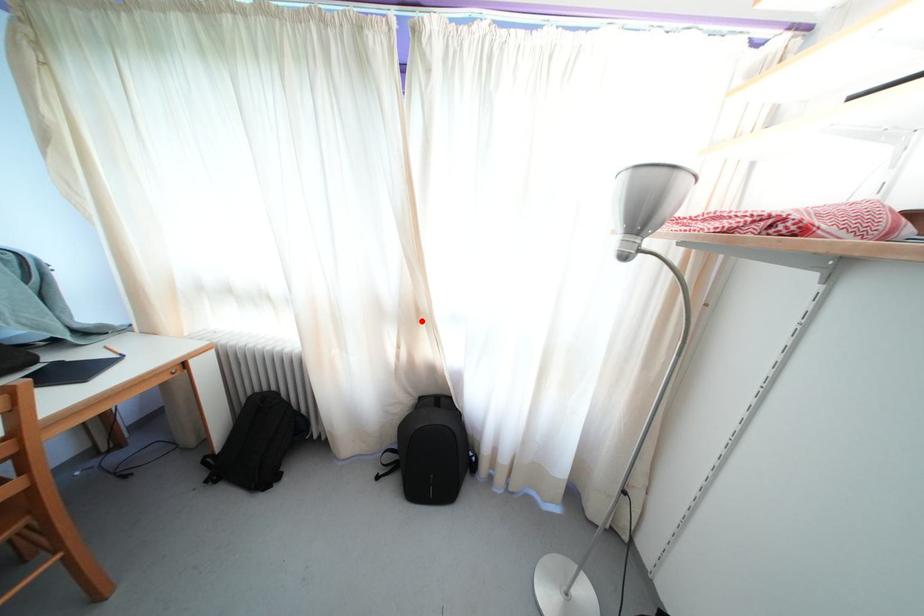
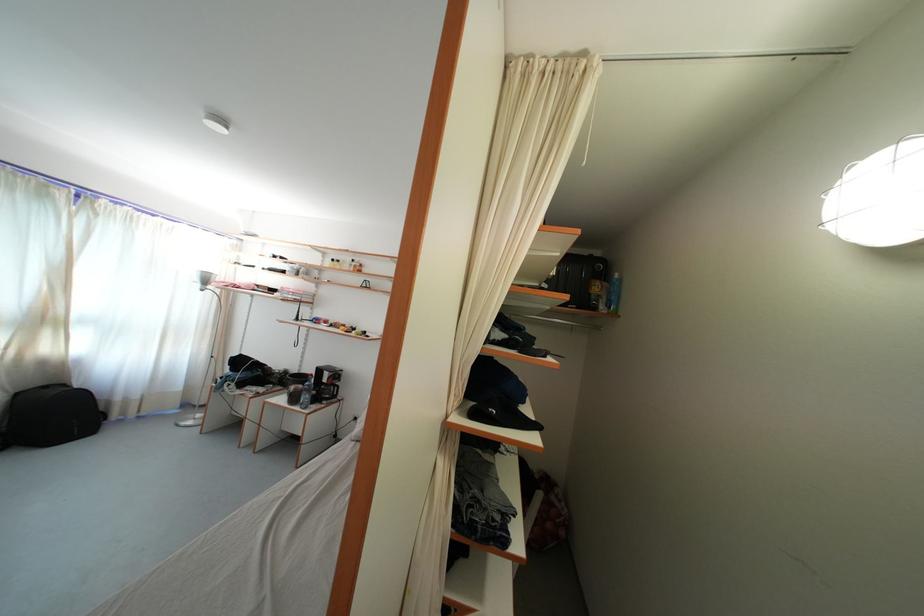
Question: A red point is marked in image1. In image2, is the corresponding 3D point closer to the camera or farther? Reply with the corresponding letter.

Choices:
 (A) The corresponding 3D point is closer.
 (B) The corresponding 3D point is farther.

Answer: (A)